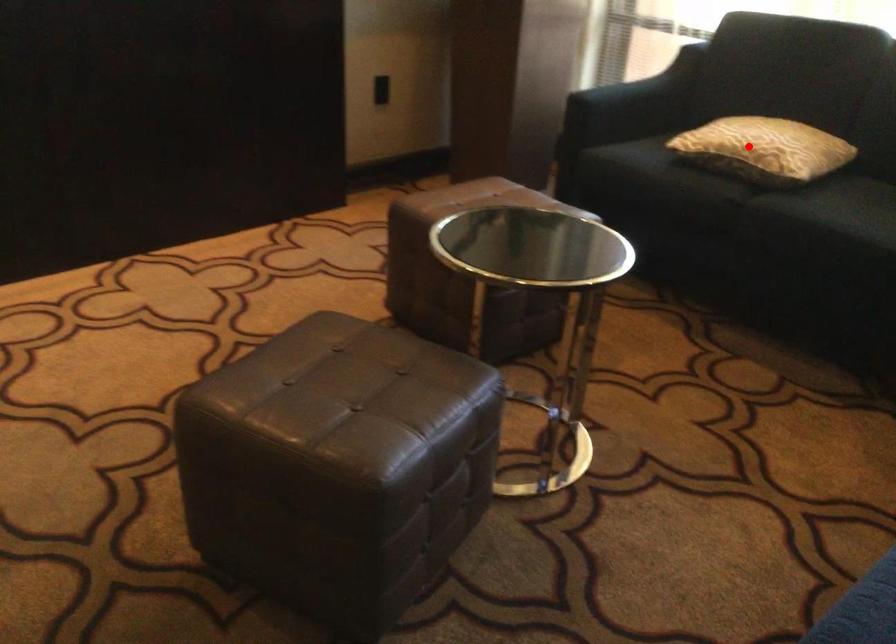
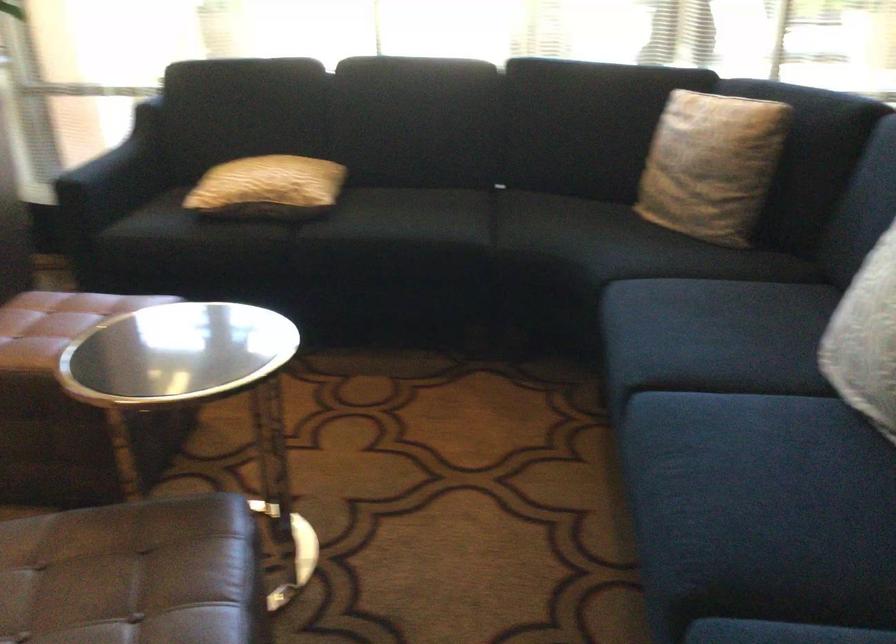
The point at the highlighted location is marked in the first image. Where is the corresponding point in the second image?

(268, 187)